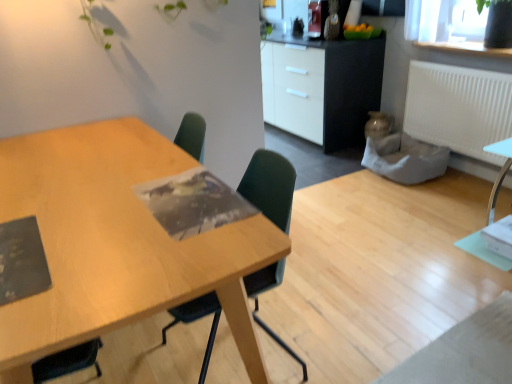
Question: From a real-world perspective, is white matte radiator at upper right above or below green plastic chair at center?

Choices:
 (A) below
 (B) above

Answer: (B)

Question: Considering their positions, is white matte radiator at upper right located in front of or behind green plastic chair at center?

Choices:
 (A) front
 (B) behind

Answer: (B)

Question: Which object is the farthest from the white glossy cabinet at upper center?

Choices:
 (A) transparent glass vase at upper right
 (B) white matte radiator at upper right
 (C) wooden table at center
 (D) green plastic chair at center

Answer: (C)

Question: Which is farther from the green plastic chair at center?

Choices:
 (A) transparent glass vase at upper right
 (B) white matte radiator at upper right
 (C) wooden table at center
 (D) white glossy cabinet at upper center

Answer: (D)